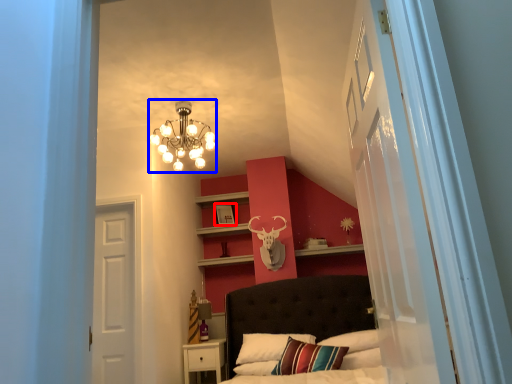
Question: Among these objects, which one is farthest to the camera, picture frame (highlighted by a red box) or lamp (highlighted by a blue box)?

Choices:
 (A) picture frame
 (B) lamp

Answer: (A)